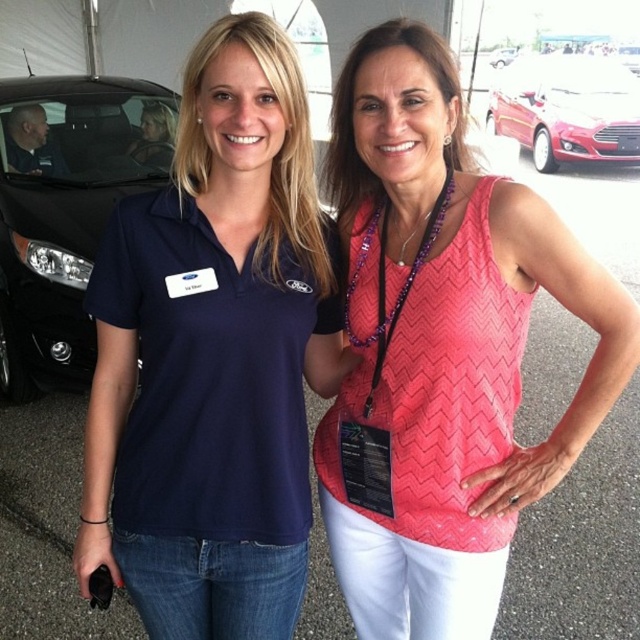
This screenshot has width=640, height=640. Identify the location of matte black car at left. (67, 211).

In the scene shown: Who is taller, matte black car at left or purple beaded lanyard at center?

Standing taller between the two is matte black car at left.

Where is `matte black car at left`? matte black car at left is located at coordinates (67, 211).

Can you confirm if pink chevron tank top at center is thinner than metallic silver car at upper center?

Yes.

Is pink chevron tank top at center in front of metallic silver car at upper center?

Yes.

Is point (461, 316) positioned in front of point (497, 67)?

Yes, it is.

You are a GUI agent. You are given a task and a screenshot of the screen. Output one action in this format:
    pyautogui.click(x=<x>, y=<y>)
    Task: Click on the pink chevron tank top at center
    This screenshot has width=640, height=640.
    Given the screenshot: What is the action you would take?
    pyautogui.click(x=445, y=346)

Which of these two, matte blue polo shirt at center or matte black car at left, stands shorter?

With less height is matte blue polo shirt at center.

Does point (156, 550) lie in front of point (10, 196)?

Yes, it is.

Locate an element on the screen. This screenshot has height=640, width=640. matte blue polo shirt at center is located at coordinates (214, 355).